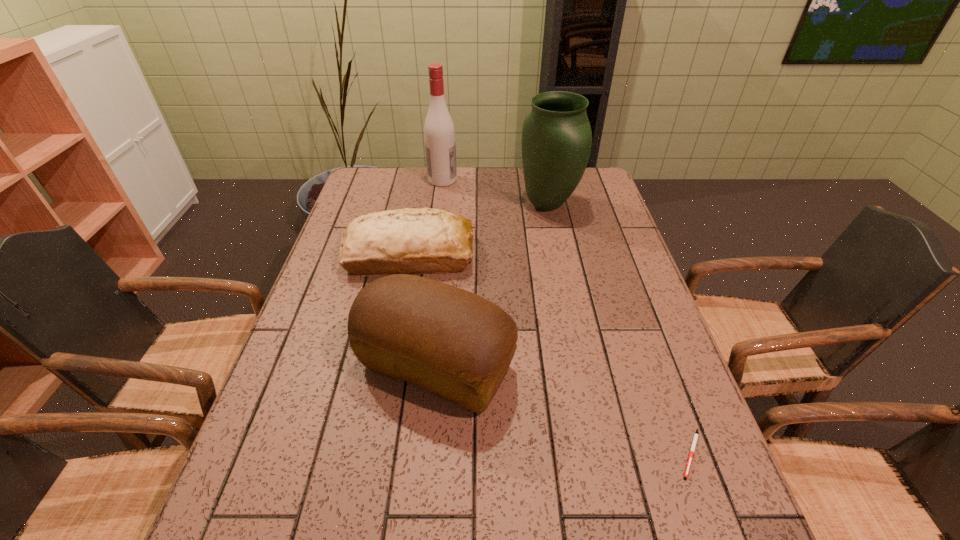
Locate an element on the screen. Image resolution: width=960 pixels, height=540 pixels. vacant space at the left edge is located at coordinates (289, 450).

At what (x,y) coordinates should I click in order to perform the action: click on free space at the right edge. Please return your answer as a coordinate pair (x, y). The image size is (960, 540). Looking at the image, I should click on (624, 323).

In the image, there is a desktop. Where is `vacant space at the far right corner`? vacant space at the far right corner is located at coordinates (582, 182).

You are a GUI agent. You are given a task and a screenshot of the screen. Output one action in this format:
    pyautogui.click(x=<x>, y=<y>)
    Task: Click on the free space between the shortest object and the second object from right to left
    
    Given the screenshot: What is the action you would take?
    pyautogui.click(x=619, y=329)

The image size is (960, 540). I want to click on empty space between the third shortest object and the shortest object, so click(x=564, y=410).

What are the coordinates of `free space that is in between the alcohol and the fourth farthest object` in the screenshot? It's located at (440, 273).

The image size is (960, 540). Find the location of `blank region between the taller bread and the vase`. blank region between the taller bread and the vase is located at coordinates (492, 286).

I want to click on free spot between the second object from right to left and the third farthest object, so click(x=479, y=230).

This screenshot has width=960, height=540. In order to click on vacant point located between the shortest object and the fourth object from left to right in this screenshot , I will do `click(619, 329)`.

You are a GUI agent. You are given a task and a screenshot of the screen. Output one action in this format:
    pyautogui.click(x=<x>, y=<y>)
    Task: Click on the free space between the pen and the second object from right to left
    
    Given the screenshot: What is the action you would take?
    tap(619, 329)